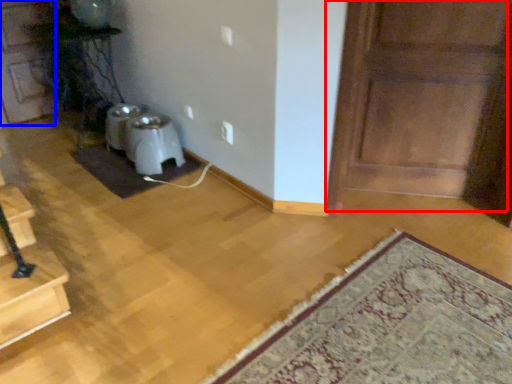
Question: Among these objects, which one is nearest to the camera, door (highlighted by a red box) or door (highlighted by a blue box)?

Choices:
 (A) door
 (B) door

Answer: (A)